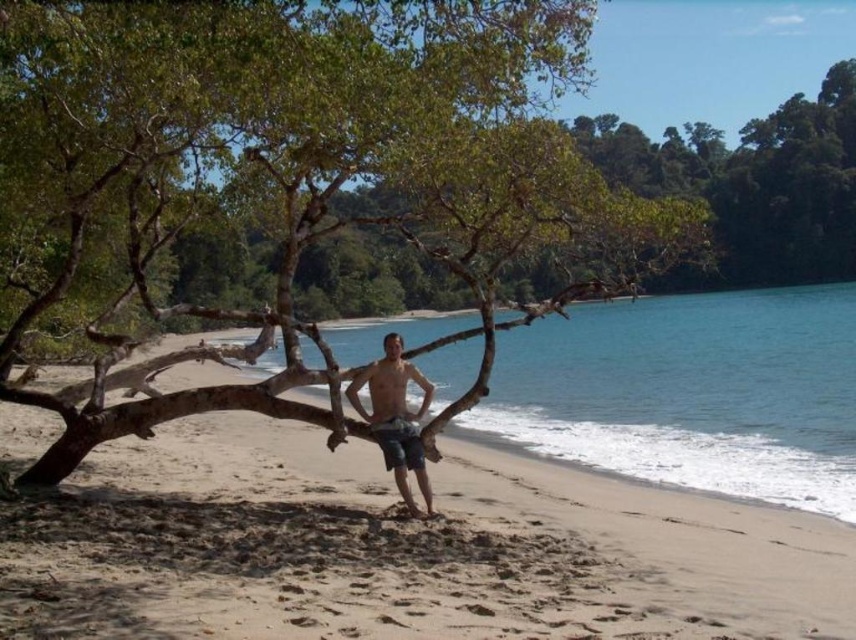
Is sandy beach at center wider than blue clear water at center?

No.

Locate an element on the screen. The image size is (856, 640). sandy beach at center is located at coordinates (400, 548).

Is sandy beach at center in front of denim shorts at center?

Yes.

Is sandy beach at center to the right of denim shorts at center from the viewer's perspective?

In fact, sandy beach at center is to the left of denim shorts at center.

Between point (794, 582) and point (357, 385), which one is positioned behind?

The point (357, 385) is behind.

Find the location of a particular element. The width and height of the screenshot is (856, 640). sandy beach at center is located at coordinates (400, 548).

Is point (550, 317) behind point (369, 419)?

Yes, it is behind point (369, 419).

Is blue clear water at center to the left of denim shorts at center from the viewer's perspective?

In fact, blue clear water at center is to the right of denim shorts at center.

Between point (437, 396) and point (399, 440), which one is positioned in front?

Point (399, 440)

The width and height of the screenshot is (856, 640). Identify the location of blue clear water at center. (691, 392).